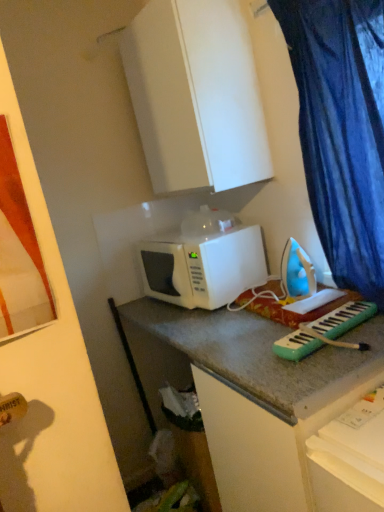
Question: Can you confirm if blue fabric curtain at right is bigger than blue plastic iron at center-right?

Choices:
 (A) no
 (B) yes

Answer: (B)

Question: From a real-world perspective, does blue fabric curtain at right sit lower than blue plastic iron at center-right?

Choices:
 (A) no
 (B) yes

Answer: (A)

Question: Does blue fabric curtain at right have a lesser width compared to blue plastic iron at center-right?

Choices:
 (A) yes
 (B) no

Answer: (B)

Question: Considering the relative sizes of blue fabric curtain at right and blue plastic iron at center-right in the image provided, is blue fabric curtain at right shorter than blue plastic iron at center-right?

Choices:
 (A) no
 (B) yes

Answer: (A)

Question: Considering the relative sizes of blue fabric curtain at right and blue plastic iron at center-right in the image provided, is blue fabric curtain at right taller than blue plastic iron at center-right?

Choices:
 (A) yes
 (B) no

Answer: (A)

Question: From the image's perspective, would you say blue fabric curtain at right is shown under blue plastic iron at center-right?

Choices:
 (A) no
 (B) yes

Answer: (A)

Question: Is white matte cabinet at upper center located within blue fabric curtain at right?

Choices:
 (A) yes
 (B) no

Answer: (B)

Question: Considering the relative positions of blue fabric curtain at right and white matte cabinet at upper center in the image provided, is blue fabric curtain at right to the right of white matte cabinet at upper center from the viewer's perspective?

Choices:
 (A) yes
 (B) no

Answer: (A)

Question: From a real-world perspective, is blue fabric curtain at right physically above white matte cabinet at upper center?

Choices:
 (A) yes
 (B) no

Answer: (B)

Question: Can you confirm if blue fabric curtain at right is bigger than white matte cabinet at upper center?

Choices:
 (A) yes
 (B) no

Answer: (B)

Question: From the image's perspective, does blue fabric curtain at right appear lower than white matte cabinet at upper center?

Choices:
 (A) yes
 (B) no

Answer: (A)

Question: Is blue fabric curtain at right thinner than white matte cabinet at upper center?

Choices:
 (A) no
 (B) yes

Answer: (B)

Question: From a real-world perspective, is white matte cabinet at upper center physically above blue plastic iron at center-right?

Choices:
 (A) yes
 (B) no

Answer: (A)